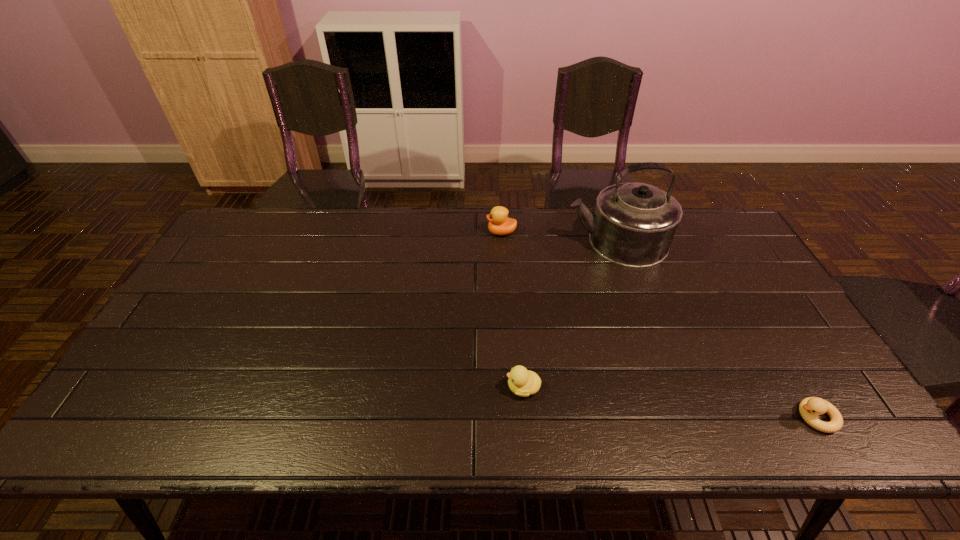
The height and width of the screenshot is (540, 960). Identify the location of vacant position located on the face of the farthest duckling. (430, 232).

Identify the location of free space located at the beak of the rightmost object. (663, 417).

The height and width of the screenshot is (540, 960). I want to click on free space located at the beak of the rightmost object, so click(x=667, y=417).

At what (x,y) coordinates should I click in order to perform the action: click on vacant space located 0.160m at the beak of the rightmost object. Please return your answer as a coordinate pair (x, y). The width and height of the screenshot is (960, 540). Looking at the image, I should click on (724, 417).

Find the location of `kettle at the far edge`. kettle at the far edge is located at coordinates (633, 225).

Identify the location of duckling that is at the far edge. This screenshot has width=960, height=540. (499, 223).

Find the location of a particular element. object that is at the near edge is located at coordinates (810, 407).

Locate an element on the screen. object present at the right edge is located at coordinates (810, 407).

Identify the location of object situated at the near right corner. The width and height of the screenshot is (960, 540). (810, 407).

Identify the location of free space at the far edge. (680, 246).